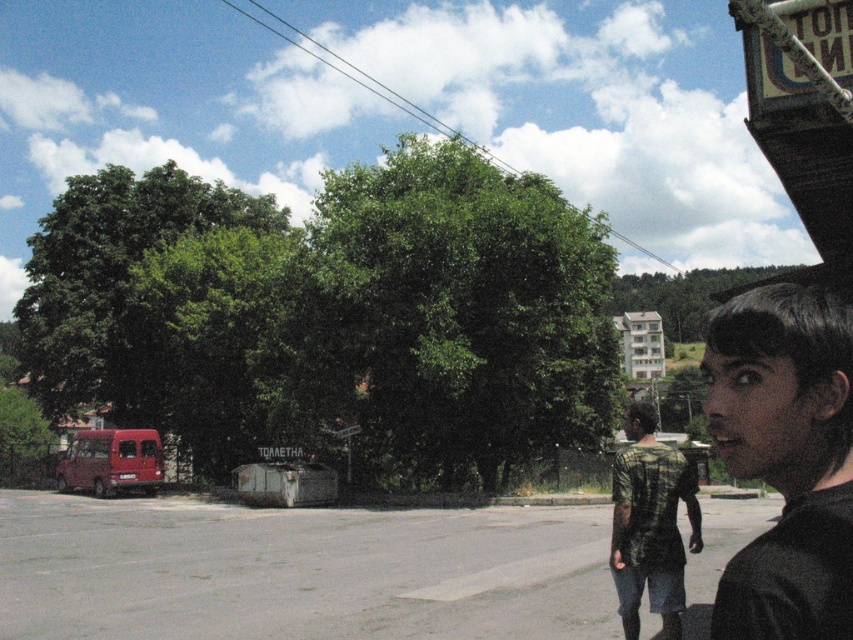
Is black matte face at right behind camo-patterned shirt at center?

No, black matte face at right is in front of camo-patterned shirt at center.

Who is more forward, (807,618) or (619,461)?

Positioned in front is point (807,618).

The width and height of the screenshot is (853, 640). What are the coordinates of `black matte face at right` in the screenshot? It's located at (785, 458).